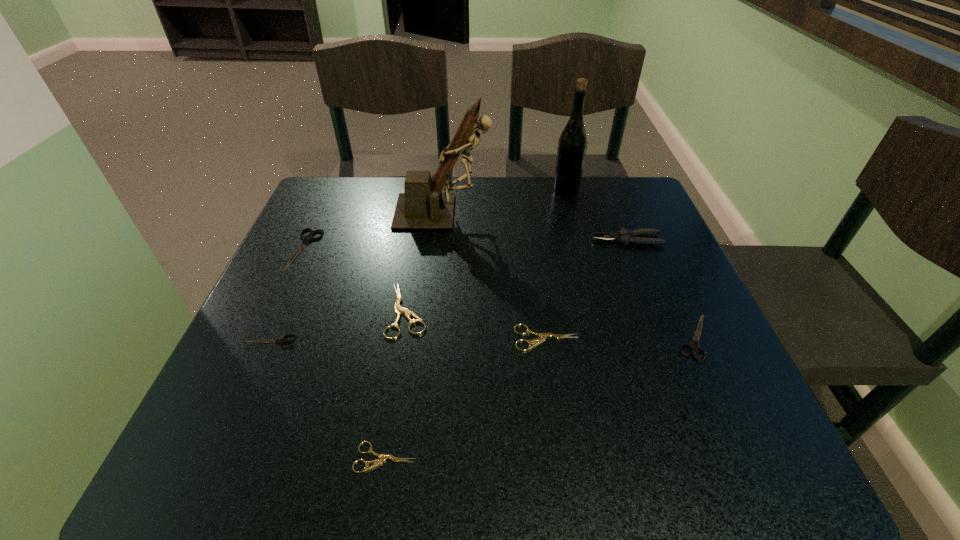
Where is `free spot between the green beer bottle and the smallest beige shears`? free spot between the green beer bottle and the smallest beige shears is located at coordinates (475, 324).

The height and width of the screenshot is (540, 960). I want to click on vacant area that lies between the beer bottle and the rightmost beige shears, so pyautogui.click(x=556, y=264).

This screenshot has width=960, height=540. I want to click on empty space between the smallest black shears and the brown figurine, so (356, 277).

Where is `vacant area between the biggest beige shears and the pliers`? vacant area between the biggest beige shears and the pliers is located at coordinates (517, 275).

The height and width of the screenshot is (540, 960). Identify the location of free space that is in between the fourth object from right to left and the nearest object. (467, 397).

Identify which object is the closest to the figurine. Please provide its 2D coordinates. Your answer should be formatted as a tuple, i.e. [(x, y)], where the tuple contains the x and y coordinates of a point satisfying the conditions above.

[(306, 239)]

Select which object is the sixth closest to the smallest black shears. Please provide its 2D coordinates. Your answer should be formatted as a tuple, i.e. [(x, y)], where the tuple contains the x and y coordinates of a point satisfying the conditions above.

[(625, 236)]

Identify which shears is the second nearest to the smallest black shears. Please provide its 2D coordinates. Your answer should be formatted as a tuple, i.e. [(x, y)], where the tuple contains the x and y coordinates of a point satisfying the conditions above.

[(306, 239)]

At what (x,y) coordinates should I click in order to perform the action: click on shears that can be found as the fifth closest to the rightmost shears. Please return your answer as a coordinate pair (x, y). The image size is (960, 540). Looking at the image, I should click on (306, 239).

Point out which black shears is positioned as the nearest to the green beer bottle. Please provide its 2D coordinates. Your answer should be formatted as a tuple, i.e. [(x, y)], where the tuple contains the x and y coordinates of a point satisfying the conditions above.

[(694, 347)]